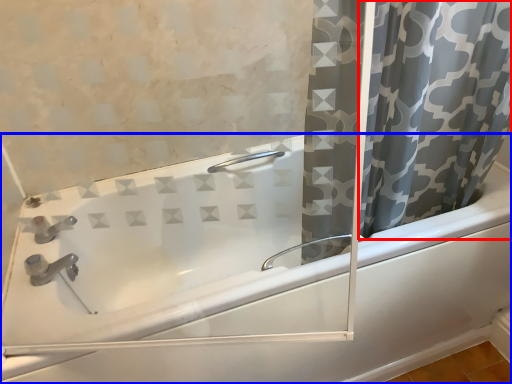
Question: Which object is closer to the camera taking this photo, curtain (highlighted by a red box) or bathtub (highlighted by a blue box)?

Choices:
 (A) curtain
 (B) bathtub

Answer: (A)